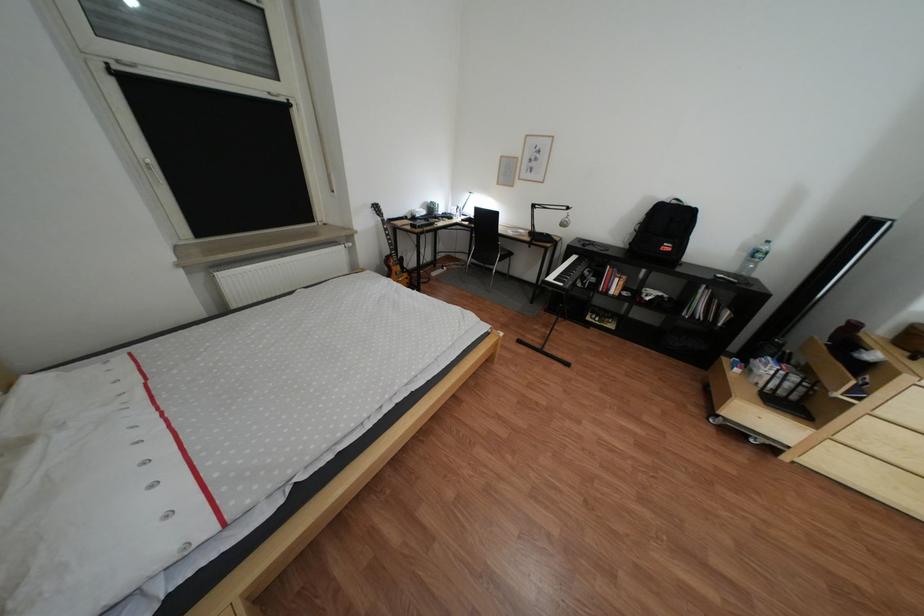
What do you see at coordinates (152, 169) in the screenshot? I see `the white window handle` at bounding box center [152, 169].